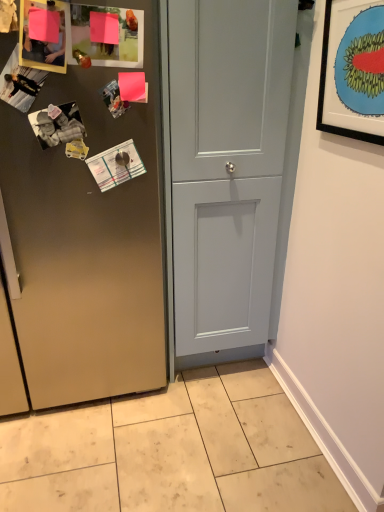
Image resolution: width=384 pixels, height=512 pixels. Identify the location of beige tile at lower center. (172, 451).

Identify the location of beige tile at lower center. Image resolution: width=384 pixels, height=512 pixels. (172, 451).

Are satin finish cabinet at center, the first door in the left-to-right sequence, and black matte picture frame at upper right far apart?

No.

Considering the sizes of objects satin finish cabinet at center, the first door in the left-to-right sequence, and black matte picture frame at upper right in the image provided, who is taller, satin finish cabinet at center, the first door in the left-to-right sequence, or black matte picture frame at upper right?

Standing taller between the two is satin finish cabinet at center, the first door in the left-to-right sequence.

Looking at their sizes, would you say satin finish cabinet at center, which is the 2th door in right-to-left order, is wider or thinner than black matte picture frame at upper right?

Considering their sizes, satin finish cabinet at center, which is the 2th door in right-to-left order, looks broader than black matte picture frame at upper right.

Considering the sizes of objects satin finish cabinet at center, which is the 2th door in right-to-left order, and black matte picture frame at upper right in the image provided, who is bigger, satin finish cabinet at center, which is the 2th door in right-to-left order, or black matte picture frame at upper right?

satin finish cabinet at center, which is the 2th door in right-to-left order, is bigger.

From a real-world perspective, who is located higher, black matte picture frame at upper right or light gray wood door at center, the first door positioned from the right?

From a 3D spatial view, black matte picture frame at upper right is above.

Which is more to the left, black matte picture frame at upper right or light gray wood door at center, the second door from the left?

Positioned to the left is light gray wood door at center, the second door from the left.

Choose the correct answer: Is black matte picture frame at upper right inside satin finish cabinet at center, the first door in the left-to-right sequence, or outside it?

black matte picture frame at upper right is located beyond the bounds of satin finish cabinet at center, the first door in the left-to-right sequence.

In terms of width, does black matte picture frame at upper right look wider or thinner when compared to satin finish cabinet at center, which is the 2th door in right-to-left order?

Considering their sizes, black matte picture frame at upper right looks slimmer than satin finish cabinet at center, which is the 2th door in right-to-left order.

Are black matte picture frame at upper right and satin finish cabinet at center, which is the 2th door in right-to-left order, located far from each other?

black matte picture frame at upper right is near satin finish cabinet at center, which is the 2th door in right-to-left order, not far away.

Is beige tile at lower center aimed at black matte picture frame at upper right?

No.

Is beige tile at lower center inside or outside of black matte picture frame at upper right?

beige tile at lower center is located beyond the bounds of black matte picture frame at upper right.

Between beige tile at lower center and black matte picture frame at upper right, which one appears on the right side from the viewer's perspective?

black matte picture frame at upper right is more to the right.

Who is more distant, beige tile at lower center or black matte picture frame at upper right?

Positioned behind is beige tile at lower center.

From the image's perspective, is black matte picture frame at upper right above or below beige tile at lower center?

black matte picture frame at upper right is above beige tile at lower center.

Does black matte picture frame at upper right touch beige tile at lower center?

black matte picture frame at upper right is not next to beige tile at lower center, and they're not touching.

Is black matte picture frame at upper right facing towards beige tile at lower center?

No.

Is black matte picture frame at upper right bigger or smaller than beige tile at lower center?

black matte picture frame at upper right is smaller than beige tile at lower center.

Which is closer, (138, 110) or (268, 226)?

Point (138, 110) appears to be closer to the viewer than point (268, 226).

Which is more to the right, satin finish cabinet at center, which is the 2th door in right-to-left order, or light gray wood door at center, the first door positioned from the right?

Positioned to the right is light gray wood door at center, the first door positioned from the right.

From a real-world perspective, relative to light gray wood door at center, the first door positioned from the right, is satin finish cabinet at center, which is the 2th door in right-to-left order, vertically above or below?

satin finish cabinet at center, which is the 2th door in right-to-left order, is below light gray wood door at center, the first door positioned from the right.

From a real-world perspective, relative to satin finish cabinet at center, which is the 2th door in right-to-left order, is light gray wood door at center, the second door from the left, vertically above or below?

light gray wood door at center, the second door from the left, is situated higher than satin finish cabinet at center, which is the 2th door in right-to-left order, in the real world.

In the scene shown: Is light gray wood door at center, the first door positioned from the right, bigger than satin finish cabinet at center, the first door in the left-to-right sequence?

Incorrect, light gray wood door at center, the first door positioned from the right, is not larger than satin finish cabinet at center, the first door in the left-to-right sequence.

Is light gray wood door at center, the first door positioned from the right, far away from satin finish cabinet at center, the first door in the left-to-right sequence?

Actually, light gray wood door at center, the first door positioned from the right, and satin finish cabinet at center, the first door in the left-to-right sequence, are a little close together.

Considering the positions of objects light gray wood door at center, the second door from the left, and satin finish cabinet at center, which is the 2th door in right-to-left order, in the image provided, who is more to the left, light gray wood door at center, the second door from the left, or satin finish cabinet at center, which is the 2th door in right-to-left order,?

satin finish cabinet at center, which is the 2th door in right-to-left order.

The width and height of the screenshot is (384, 512). There is a black matte picture frame at upper right. Identify the location of the 2nd door below it (from the image's perspective). (87, 242).

Locate an element on the screen. picture frame in front of the light gray wood door at center, the second door from the left is located at coordinates (x=353, y=71).

Estimate the real-world distances between objects in this image. Which object is further from black matte picture frame at upper right, light gray wood door at center, the first door positioned from the right, or beige tile at lower center?

Based on the image, beige tile at lower center appears to be further to black matte picture frame at upper right.

Which object lies nearer to the anchor point light gray wood door at center, the second door from the left, beige tile at lower center or black matte picture frame at upper right?

Based on the image, black matte picture frame at upper right appears to be nearer to light gray wood door at center, the second door from the left.

Looking at the image, which one is located closer to light gray wood door at center, the second door from the left, beige tile at lower center or satin finish cabinet at center, the first door in the left-to-right sequence?

satin finish cabinet at center, the first door in the left-to-right sequence, lies closer to light gray wood door at center, the second door from the left, than the other object.

Which object lies further to the anchor point beige tile at lower center, satin finish cabinet at center, the first door in the left-to-right sequence, or light gray wood door at center, the second door from the left?

The object further to beige tile at lower center is light gray wood door at center, the second door from the left.

Looking at the image, which one is located closer to black matte picture frame at upper right, beige tile at lower center or satin finish cabinet at center, the first door in the left-to-right sequence?

satin finish cabinet at center, the first door in the left-to-right sequence, is closer to black matte picture frame at upper right.

Looking at the image, which one is located further to satin finish cabinet at center, which is the 2th door in right-to-left order, black matte picture frame at upper right or beige tile at lower center?

black matte picture frame at upper right is further to satin finish cabinet at center, which is the 2th door in right-to-left order.

Which object lies further to the anchor point beige tile at lower center, light gray wood door at center, the second door from the left, or black matte picture frame at upper right?

black matte picture frame at upper right is further to beige tile at lower center.

Estimate the real-world distances between objects in this image. Which object is closer to beige tile at lower center, light gray wood door at center, the first door positioned from the right, or satin finish cabinet at center, the first door in the left-to-right sequence?

satin finish cabinet at center, the first door in the left-to-right sequence, is positioned closer to the anchor beige tile at lower center.

The height and width of the screenshot is (512, 384). I want to click on door between light gray wood door at center, the first door positioned from the right, and beige tile at lower center in the up-down direction, so click(x=87, y=242).

This screenshot has height=512, width=384. What are the coordinates of `door situated between satin finish cabinet at center, the first door in the left-to-right sequence, and black matte picture frame at upper right from left to right` in the screenshot? It's located at tap(226, 166).